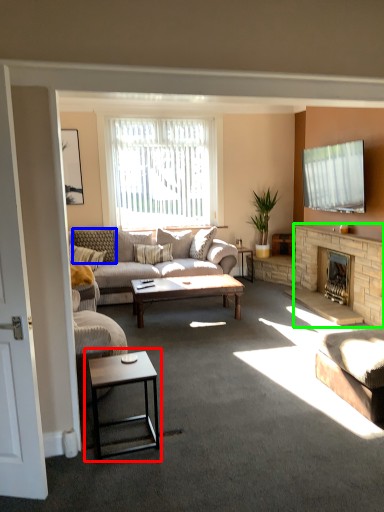
Question: Based on their relative distances, which object is farther from coffee table (highlighted by a red box)? Choose from pillow (highlighted by a blue box) and fireplace (highlighted by a green box).

Choices:
 (A) pillow
 (B) fireplace

Answer: (A)